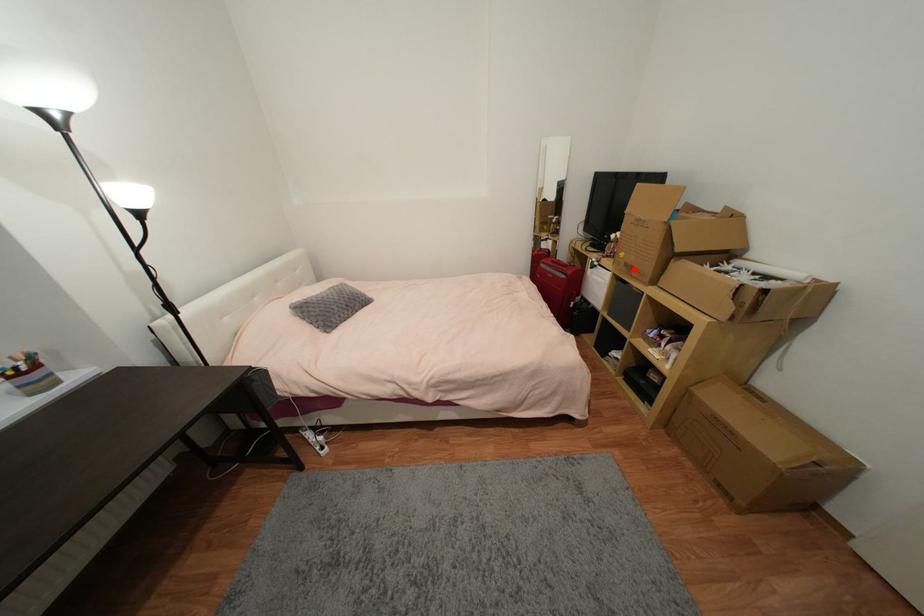
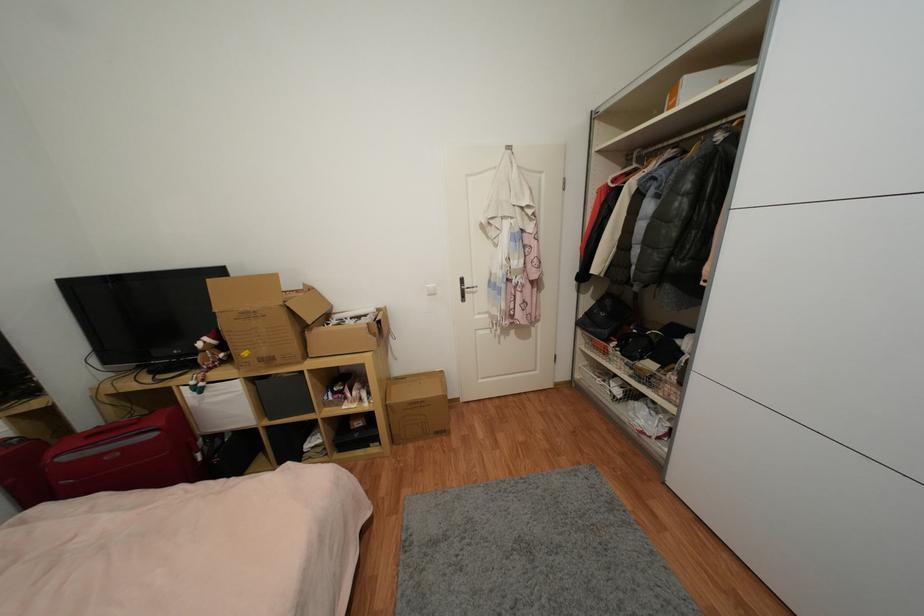
Question: I am providing you with two images of the same scene from different viewpoints. A red point is shown in image1. For the corresponding object point in image2, is it positioned nearer or farther from the camera?

Choices:
 (A) Nearer
 (B) Farther

Answer: (B)